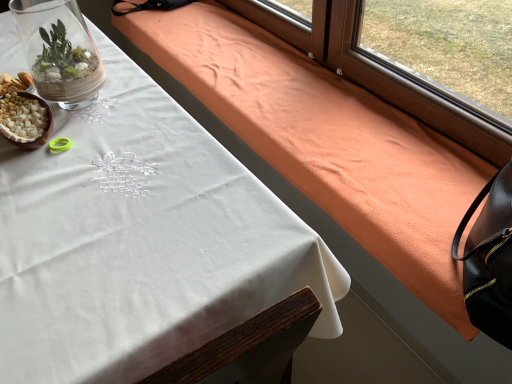
The width and height of the screenshot is (512, 384). Find the location of `free space behind clear glass terrarium at upper left`. free space behind clear glass terrarium at upper left is located at coordinates (116, 66).